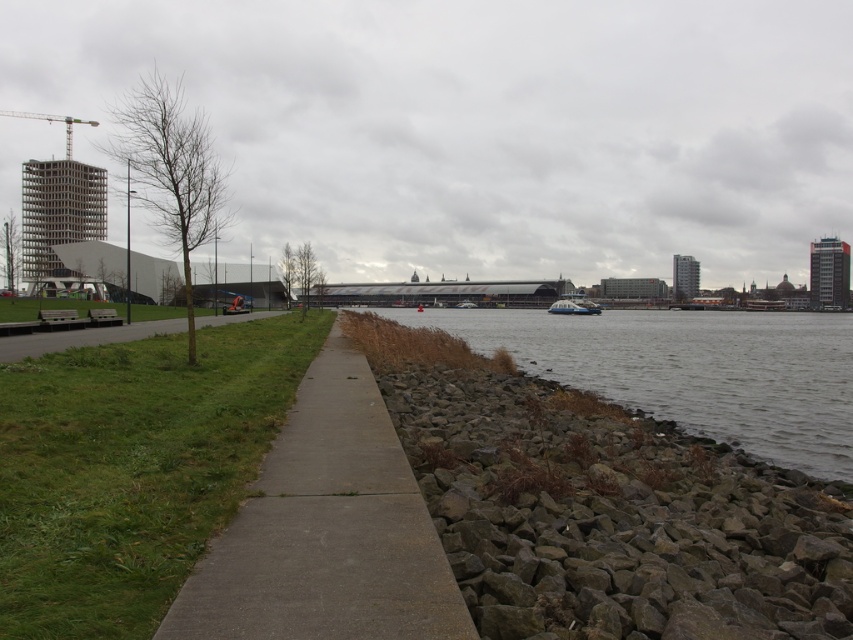
Question: Can you confirm if concrete sidewalk at center is positioned to the right of gray stone river at center?

Choices:
 (A) no
 (B) yes

Answer: (A)

Question: Does concrete sidewalk at center have a smaller size compared to gray stone river at center?

Choices:
 (A) no
 (B) yes

Answer: (B)

Question: Which point is closer to the camera?

Choices:
 (A) (332, 582)
 (B) (718, 353)

Answer: (A)

Question: Among these points, which one is farthest from the camera?

Choices:
 (A) (636, 326)
 (B) (341, 508)

Answer: (A)

Question: Does concrete sidewalk at center appear on the left side of gray stone river at center?

Choices:
 (A) no
 (B) yes

Answer: (B)